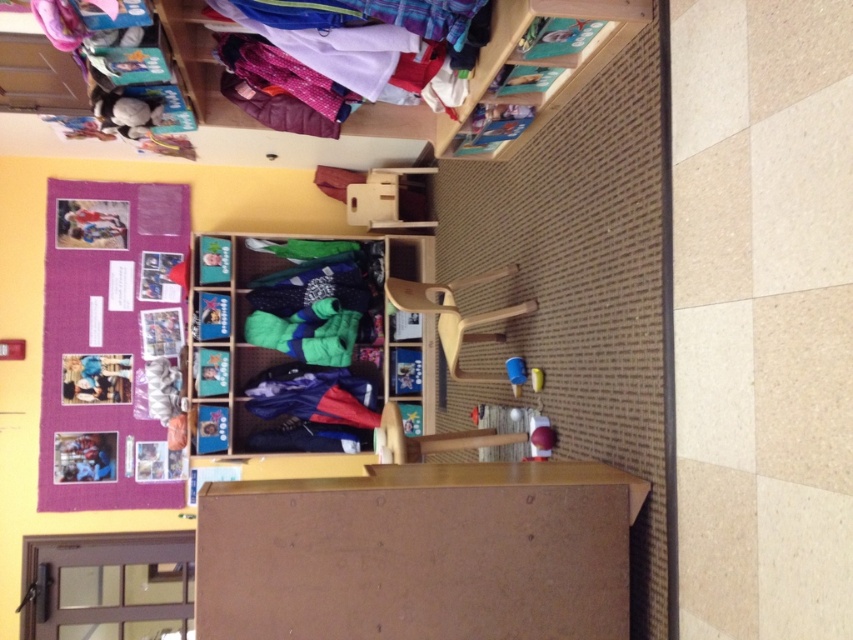
Is soft fleece socks at center closer to camera compared to shiny polyester jackets at upper center?

No, it is not.

Is point (323, 275) farther from camera compared to point (329, 68)?

Yes.

Identify the location of soft fleece socks at center. (314, 340).

From the picture: Does purple fabric bulletin board at upper left have a greater height compared to soft fleece socks at center?

Yes.

The image size is (853, 640). What do you see at coordinates (113, 346) in the screenshot? I see `purple fabric bulletin board at upper left` at bounding box center [113, 346].

In order to click on purple fabric bulletin board at upper left in this screenshot , I will do `click(113, 346)`.

Who is higher up, purple fabric bulletin board at upper left or shiny polyester jackets at upper center?

shiny polyester jackets at upper center

Does point (45, 276) lie behind point (323, 36)?

Yes, it is behind point (323, 36).

Where is `purple fabric bulletin board at upper left`? This screenshot has width=853, height=640. purple fabric bulletin board at upper left is located at coordinates [x=113, y=346].